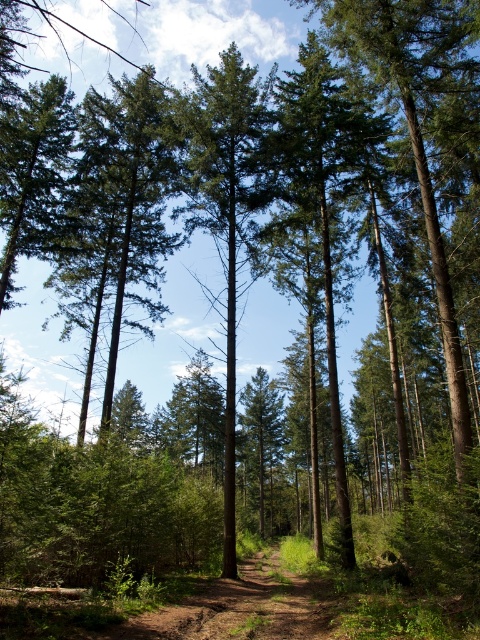
Question: Which point is farther from the camera taking this photo?

Choices:
 (A) (349, 525)
 (B) (252, 72)

Answer: (B)

Question: Can you confirm if green rough bark tree at center is positioned below green matte tree at center?

Choices:
 (A) yes
 (B) no

Answer: (B)

Question: Which object is farther from the camera taking this photo?

Choices:
 (A) green rough bark tree at center
 (B) green matte tree at center

Answer: (A)

Question: Can you confirm if green rough bark tree at center is smaller than green matte tree at center?

Choices:
 (A) yes
 (B) no

Answer: (B)

Question: Which object appears farthest from the camera in this image?

Choices:
 (A) green rough bark tree at center
 (B) green matte tree at center

Answer: (A)

Question: Is green rough bark tree at center to the right of green matte tree at center from the viewer's perspective?

Choices:
 (A) no
 (B) yes

Answer: (B)